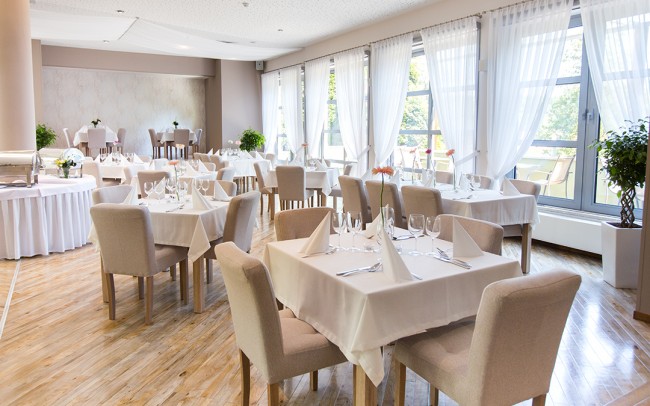
Where is `curtain rods`? Image resolution: width=650 pixels, height=406 pixels. curtain rods is located at coordinates (288, 71), (344, 53), (428, 22), (500, 12).